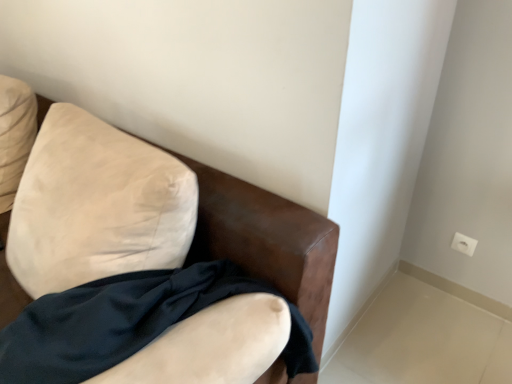
What do you see at coordinates (111, 320) in the screenshot?
I see `satin black fabric at lower left` at bounding box center [111, 320].

Identify the location of white plastic electric outlet at upper right. The width and height of the screenshot is (512, 384). (464, 244).

The height and width of the screenshot is (384, 512). In order to click on satin black fabric at lower left in this screenshot , I will do `click(111, 320)`.

Is satin black fabric at lower left closer to the viewer compared to white plastic electric outlet at upper right?

Yes, satin black fabric at lower left is closer to the viewer.

From a real-world perspective, between satin black fabric at lower left and white plastic electric outlet at upper right, who is vertically lower?

From a 3D spatial view, white plastic electric outlet at upper right is below.

Does point (40, 318) come closer to viewer compared to point (453, 240)?

Yes, point (40, 318) is closer to viewer.

Is satin black fabric at lower left inside or outside of white plastic electric outlet at upper right?

The correct answer is: outside.

From a real-world perspective, is white plastic electric outlet at upper right over suede-like beige armchair at upper left?

Actually, white plastic electric outlet at upper right is physically below suede-like beige armchair at upper left in the real world.

From the image's perspective, does white plastic electric outlet at upper right appear lower than suede-like beige armchair at upper left?

Correct, white plastic electric outlet at upper right appears lower than suede-like beige armchair at upper left in the image.

Looking at this image, in terms of height, does white plastic electric outlet at upper right look taller or shorter compared to suede-like beige armchair at upper left?

Considering their sizes, white plastic electric outlet at upper right has less height than suede-like beige armchair at upper left.

Image resolution: width=512 pixels, height=384 pixels. In order to click on electric outlet behind the suede-like beige armchair at upper left in this screenshot , I will do `click(464, 244)`.

Is point (18, 197) less distant than point (457, 248)?

Yes, it is in front of point (457, 248).

Considering the sizes of objects suede-like beige armchair at upper left and white plastic electric outlet at upper right in the image provided, who is shorter, suede-like beige armchair at upper left or white plastic electric outlet at upper right?

With less height is white plastic electric outlet at upper right.

What's the angular difference between suede-like beige armchair at upper left and satin black fabric at lower left's facing directions?

There is a 12-degree angle between the facing directions of suede-like beige armchair at upper left and satin black fabric at lower left.

Is suede-like beige armchair at upper left in front of or behind satin black fabric at lower left in the image?

In the image, suede-like beige armchair at upper left appears in front of satin black fabric at lower left.

Does suede-like beige armchair at upper left have a greater height compared to satin black fabric at lower left?

Correct, suede-like beige armchair at upper left is much taller as satin black fabric at lower left.

Which is correct: suede-like beige armchair at upper left is inside satin black fabric at lower left, or outside of it?

suede-like beige armchair at upper left is spatially situated outside satin black fabric at lower left.

Which is more to the left, white plastic electric outlet at upper right or satin black fabric at lower left?

satin black fabric at lower left is more to the left.

From the image's perspective, does white plastic electric outlet at upper right appear higher than satin black fabric at lower left?

Yes, from the image's perspective, white plastic electric outlet at upper right is over satin black fabric at lower left.

Are white plastic electric outlet at upper right and satin black fabric at lower left beside each other?

There is a gap between white plastic electric outlet at upper right and satin black fabric at lower left.

Consider the image. From a real-world perspective, which is physically above, white plastic electric outlet at upper right or satin black fabric at lower left?

satin black fabric at lower left.

What's the angular difference between satin black fabric at lower left and suede-like beige armchair at upper left's facing directions?

There is a 12-degree angle between the facing directions of satin black fabric at lower left and suede-like beige armchair at upper left.

Is satin black fabric at lower left wider than suede-like beige armchair at upper left?

No, satin black fabric at lower left is not wider than suede-like beige armchair at upper left.

Is satin black fabric at lower left taller or shorter than suede-like beige armchair at upper left?

In the image, satin black fabric at lower left appears to be shorter than suede-like beige armchair at upper left.

You are a GUI agent. You are given a task and a screenshot of the screen. Output one action in this format:
    pyautogui.click(x=<x>, y=<y>)
    Task: Click on the electric outlet that appears below the satin black fabric at lower left (from a real-world perspective)
    The height and width of the screenshot is (384, 512).
    Given the screenshot: What is the action you would take?
    pyautogui.click(x=464, y=244)

Where is `electric outlet on the right of the suede-like beige armchair at upper left`? The height and width of the screenshot is (384, 512). electric outlet on the right of the suede-like beige armchair at upper left is located at coordinates (464, 244).

Which object lies nearer to the anchor point satin black fabric at lower left, suede-like beige armchair at upper left or white plastic electric outlet at upper right?

suede-like beige armchair at upper left is positioned closer to the anchor satin black fabric at lower left.

When comparing their distances from white plastic electric outlet at upper right, does satin black fabric at lower left or suede-like beige armchair at upper left seem closer?

suede-like beige armchair at upper left is positioned closer to the anchor white plastic electric outlet at upper right.

When comparing their distances from satin black fabric at lower left, does white plastic electric outlet at upper right or suede-like beige armchair at upper left seem further?

The object further to satin black fabric at lower left is white plastic electric outlet at upper right.

Based on their spatial positions, is suede-like beige armchair at upper left or satin black fabric at lower left further from white plastic electric outlet at upper right?

satin black fabric at lower left lies further to white plastic electric outlet at upper right than the other object.

When comparing their distances from suede-like beige armchair at upper left, does white plastic electric outlet at upper right or satin black fabric at lower left seem further?

white plastic electric outlet at upper right is positioned further to the anchor suede-like beige armchair at upper left.

Looking at the image, which one is located further to suede-like beige armchair at upper left, satin black fabric at lower left or white plastic electric outlet at upper right?

Among the two, white plastic electric outlet at upper right is located further to suede-like beige armchair at upper left.

Where is `fabric situated between suede-like beige armchair at upper left and white plastic electric outlet at upper right from left to right`? fabric situated between suede-like beige armchair at upper left and white plastic electric outlet at upper right from left to right is located at coordinates (111, 320).